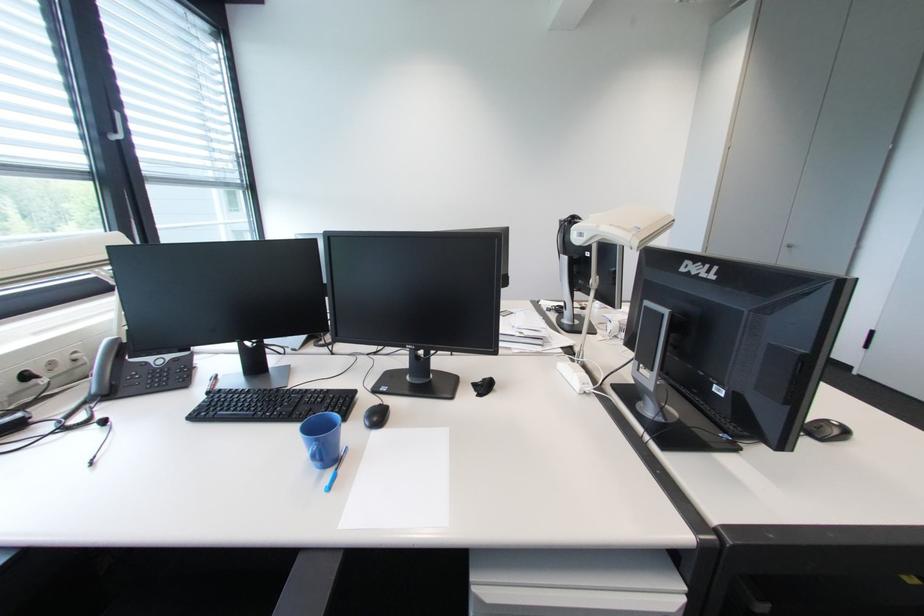
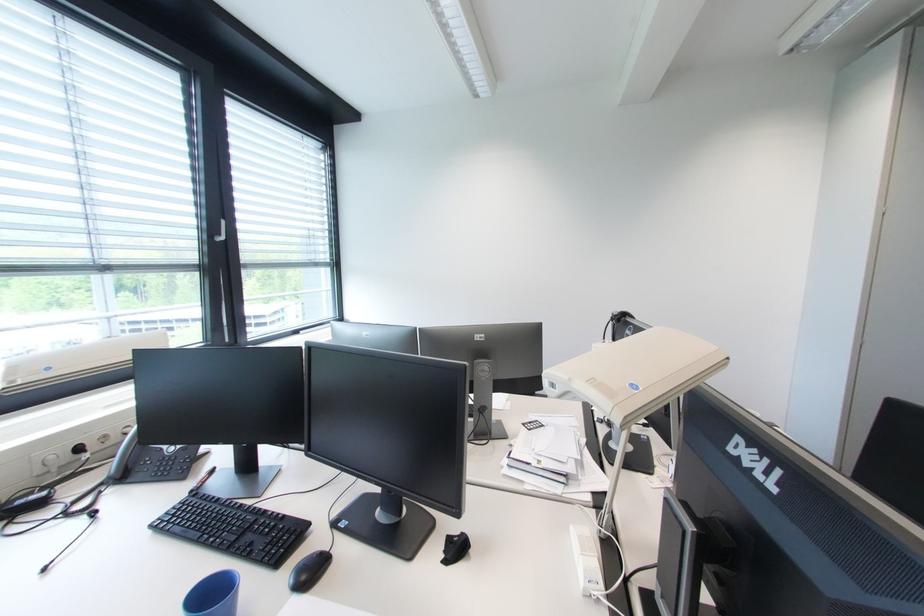
Find the pixel in the second image that matches point (334, 392) in the first image.

(290, 517)